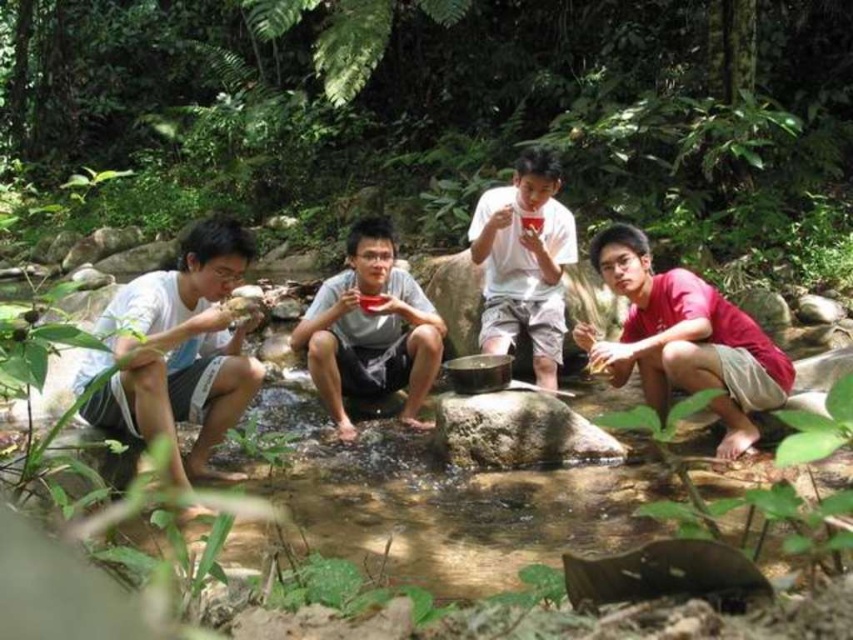
Question: Is clear water at creek center bigger than gray matte bowl at center?

Choices:
 (A) no
 (B) yes

Answer: (B)

Question: Considering the real-world distances, which object is closest to the green leafy forest at upper center?

Choices:
 (A) white matte cup at center
 (B) smooth gray rock at center
 (C) gray matte bowl at center

Answer: (A)

Question: Does green leafy forest at upper center appear on the right side of gray matte bowl at center?

Choices:
 (A) no
 (B) yes

Answer: (A)

Question: Can you confirm if gray matte bowl at center is bigger than white matte cup at center?

Choices:
 (A) yes
 (B) no

Answer: (B)

Question: Which object appears closest to the camera in this image?

Choices:
 (A) gray matte bowl at center
 (B) green leafy forest at upper center

Answer: (A)

Question: Which of these objects is positioned farthest from the white matte cup at center?

Choices:
 (A) green leafy forest at upper center
 (B) clear water at creek center

Answer: (A)